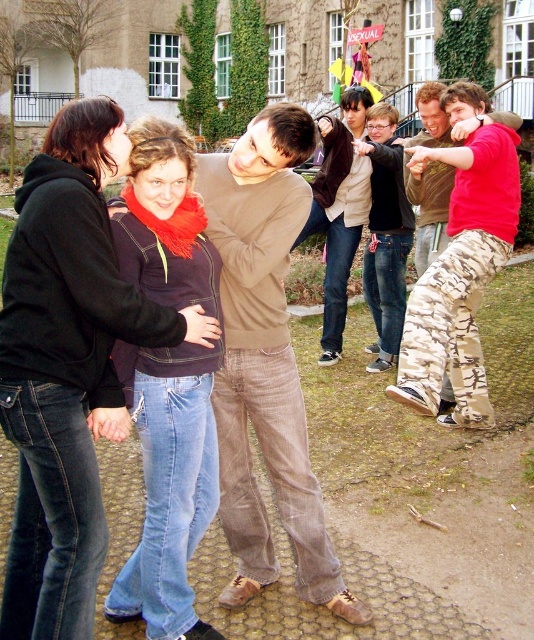
Which is behind, point (28, 573) or point (380, 232)?

Positioned behind is point (380, 232).

Is denim jeans at left below camouflage pants at center?

Indeed, denim jeans at left is positioned under camouflage pants at center.

The image size is (534, 640). Describe the element at coordinates (67, 368) in the screenshot. I see `denim jeans at left` at that location.

You are a GUI agent. You are given a task and a screenshot of the screen. Output one action in this format:
    pyautogui.click(x=<x>, y=<y>)
    Task: Click on the denim jeans at left
    This screenshot has height=640, width=534.
    Given the screenshot: What is the action you would take?
    pyautogui.click(x=67, y=368)

Does brown corduroy pants at center have a greater height compared to camouflage pants at center?

No, brown corduroy pants at center is not taller than camouflage pants at center.

Does brown corduroy pants at center appear under camouflage pants at center?

Yes, brown corduroy pants at center is below camouflage pants at center.

Image resolution: width=534 pixels, height=640 pixels. Describe the element at coordinates (265, 360) in the screenshot. I see `brown corduroy pants at center` at that location.

Identify the location of brown corduroy pants at center. (265, 360).

Can you confirm if brown suede jacket at center is wider than camouflage pants at center?

Incorrect, brown suede jacket at center's width does not surpass camouflage pants at center's.

This screenshot has height=640, width=534. Describe the element at coordinates (340, 211) in the screenshot. I see `brown suede jacket at center` at that location.

Identify the location of brown suede jacket at center. The image size is (534, 640). (340, 211).